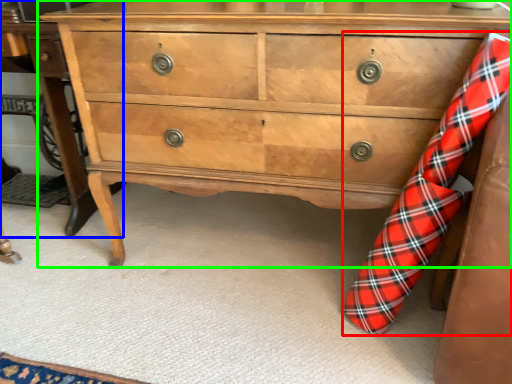
Question: Estimate the real-world distances between objects in this image. Which object is closer to sock (highlighted by a red box), table (highlighted by a blue box) or chest of drawers (highlighted by a green box)?

Choices:
 (A) table
 (B) chest of drawers

Answer: (B)